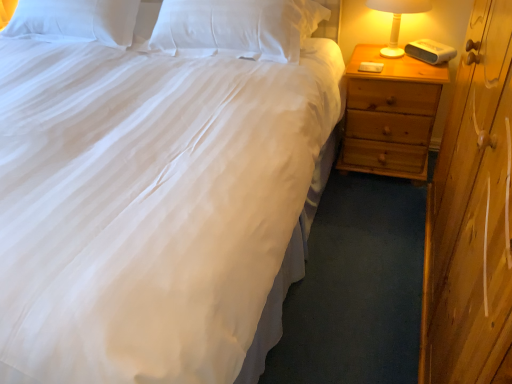
Question: Should I look upward or downward to see white plastic lamp at right?

Choices:
 (A) down
 (B) up

Answer: (B)

Question: Is white plastic lamp at right far from white soft pillow at upper center, the 2th pillow in the left-to-right sequence?

Choices:
 (A) no
 (B) yes

Answer: (A)

Question: Could you tell me if white plastic lamp at right is facing white soft pillow at upper center, which is the 1th pillow in right-to-left order?

Choices:
 (A) yes
 (B) no

Answer: (B)

Question: Is white plastic lamp at right thinner than white soft pillow at upper center, which is the 1th pillow in right-to-left order?

Choices:
 (A) no
 (B) yes

Answer: (B)

Question: From the image's perspective, does white plastic lamp at right appear higher than white soft pillow at upper center, which is the 1th pillow in right-to-left order?

Choices:
 (A) yes
 (B) no

Answer: (B)

Question: Considering the relative sizes of white plastic lamp at right and white soft pillow at upper center, which is the 1th pillow in right-to-left order, in the image provided, is white plastic lamp at right taller than white soft pillow at upper center, which is the 1th pillow in right-to-left order,?

Choices:
 (A) yes
 (B) no

Answer: (A)

Question: Considering the relative sizes of white plastic lamp at right and white soft pillow at upper center, which is the 1th pillow in right-to-left order, in the image provided, is white plastic lamp at right wider than white soft pillow at upper center, which is the 1th pillow in right-to-left order,?

Choices:
 (A) yes
 (B) no

Answer: (B)

Question: Is white soft pillow at upper center, the 2th pillow in the left-to-right sequence, bigger than white plastic lamp at right?

Choices:
 (A) no
 (B) yes

Answer: (B)

Question: Would you say white soft pillow at upper center, the 2th pillow in the left-to-right sequence, contains white plastic lamp at right?

Choices:
 (A) no
 (B) yes

Answer: (A)

Question: Is white soft pillow at upper center, which is the 1th pillow in right-to-left order, far from white plastic lamp at right?

Choices:
 (A) yes
 (B) no

Answer: (B)

Question: From a real-world perspective, is white soft pillow at upper center, which is the 1th pillow in right-to-left order, located beneath white plastic lamp at right?

Choices:
 (A) yes
 (B) no

Answer: (B)

Question: Could you tell me if white soft pillow at upper center, which is the 1th pillow in right-to-left order, is turned towards white plastic lamp at right?

Choices:
 (A) no
 (B) yes

Answer: (A)

Question: From the image's perspective, is white soft pillow at upper center, the 2th pillow in the left-to-right sequence, above white plastic lamp at right?

Choices:
 (A) yes
 (B) no

Answer: (A)

Question: Is white soft pillow at upper center, the 2th pillow in the left-to-right sequence, beside light brown wood nightstand at right?

Choices:
 (A) yes
 (B) no

Answer: (B)